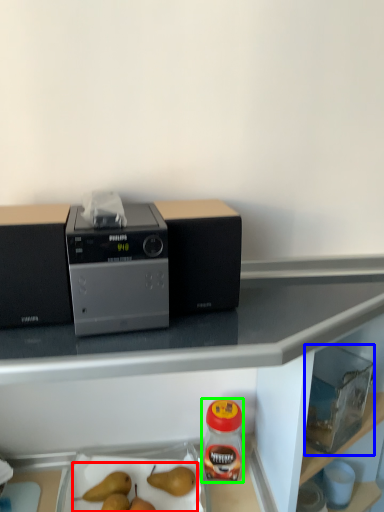
Question: Which object is the closest to the fruit (highlighted by a red box)? Choose among these: appliance (highlighted by a blue box) or bottle (highlighted by a green box).

Choices:
 (A) appliance
 (B) bottle

Answer: (B)